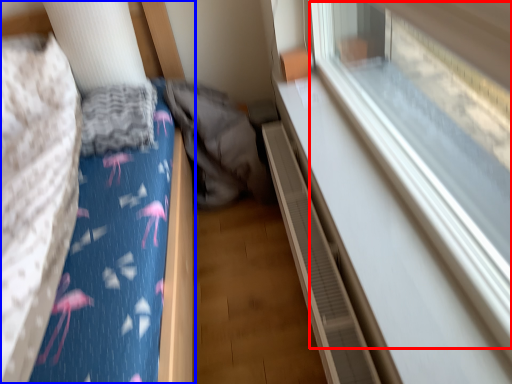
Question: Which object appears closest to the camera in this image, train window (highlighted by a red box) or furniture (highlighted by a blue box)?

Choices:
 (A) train window
 (B) furniture

Answer: (A)